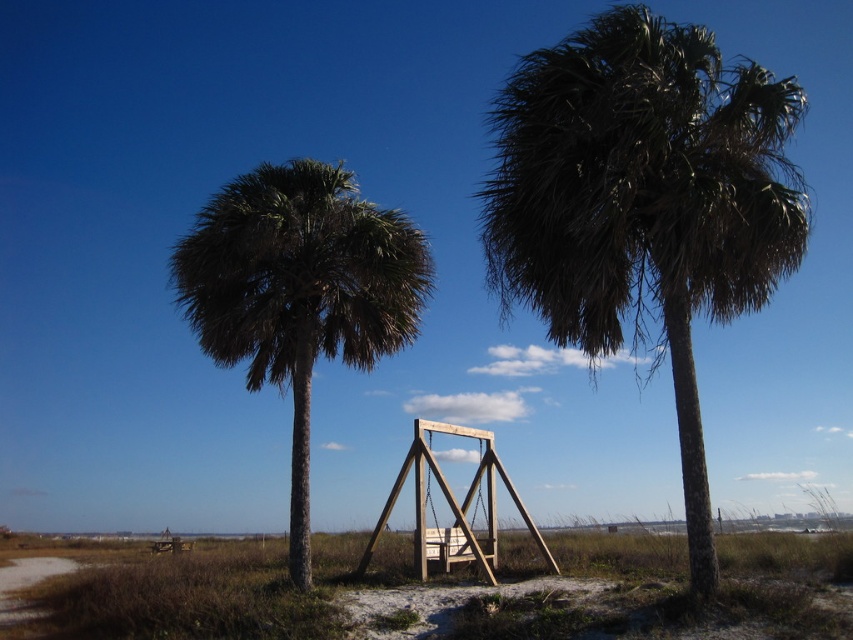
You are planning to hang a birdhouse between the two palm trees in the scene. The birdhouse requires at least 3 meters of vertical clearance to avoid touching the lower branches of both trees. Given the height difference between the dark green leafy palm at center and the green leafy palm tree at center, can you determine if the birdhouse will fit without touching the branches?

The dark green leafy palm at center is taller than the green leafy palm tree at center. However, the exact heights of their lower branches are not provided. Without specific measurements of the branch heights, it is impossible to confirm if the 3 meters of vertical clearance is sufficient to avoid touching the branches of both trees.

You are planning to hang a large birdhouse between the two palm trees in the scene. The birdhouse requires at least 2 meters of space between the trunks of the two palm trees to be securely installed. Based on the information provided, can you determine if there is enough space between the dark green leafy palm at center and the green leafy palm tree at center for this installation?

The dark green leafy palm at center is bigger than the green leafy palm tree at center, but the distance between their trunks is not specified in the provided information. Therefore, it is impossible to determine if there is enough space for the birdhouse installation based solely on the given details.

You are standing in the middle of the outdoor scene looking at two points marked in the image. Which point, point (583, 182) or point (335, 323), is closer to you?

Point (583, 182) is closer to the viewer than point (335, 323).